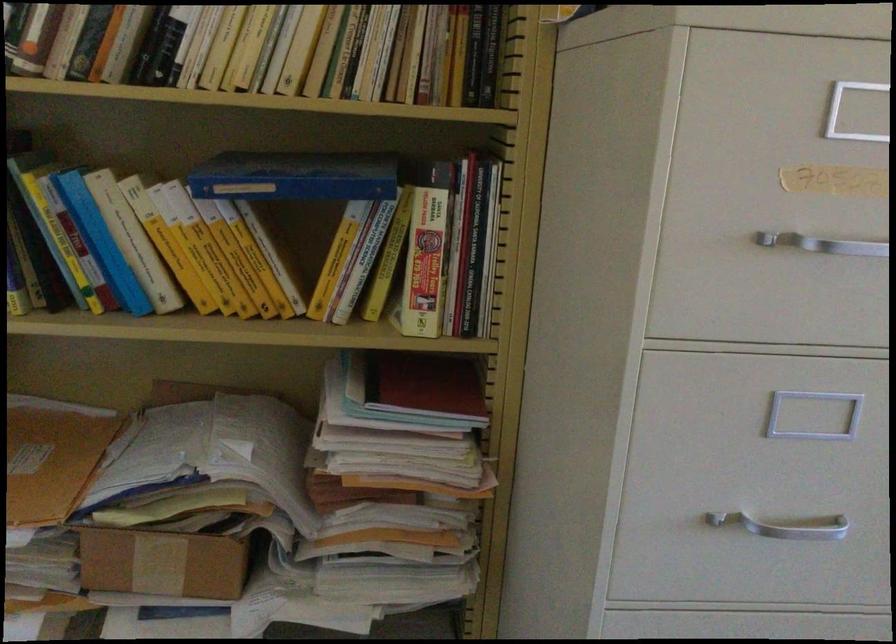
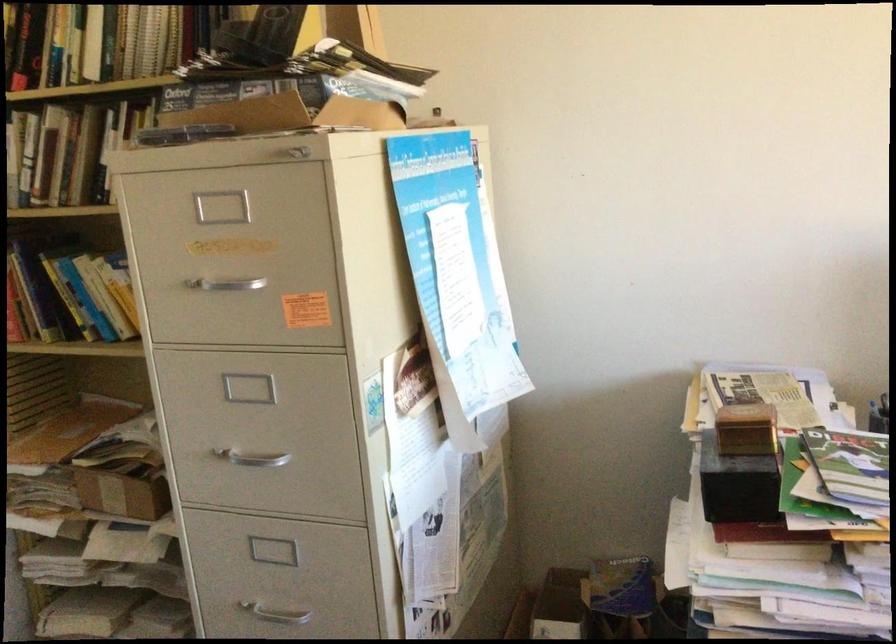
Find the pixel in the second image that matches pixel 751 522 in the first image.

(251, 458)